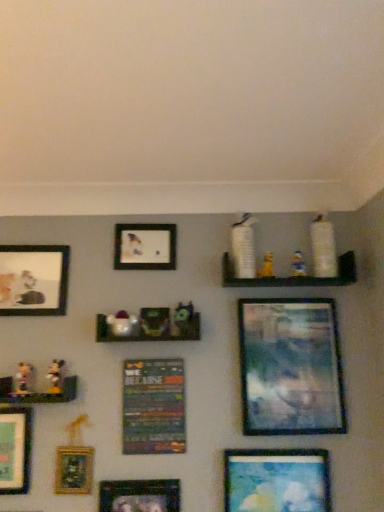
This screenshot has width=384, height=512. I want to click on matte glass picture frame at center right, the 1th picture frame from the right, so click(x=291, y=367).

Measure the distance between matte green picture frame at lower left, the first picture frame positioned from the left, and camera.

The depth of matte green picture frame at lower left, the first picture frame positioned from the left, is 4.33 feet.

This screenshot has height=512, width=384. Describe the element at coordinates (121, 323) in the screenshot. I see `matte plastic toy at center, the fifth toy viewed from the right` at that location.

What do you see at coordinates (55, 376) in the screenshot? The width and height of the screenshot is (384, 512). I see `shiny metallic mickey mouse at lower left, the 6th toy in the right-to-left sequence` at bounding box center [55, 376].

Consider the image. Measure the distance between matte black picture frame at upper center, which is counted as the fifth picture frame, starting from the left, and camera.

matte black picture frame at upper center, which is counted as the fifth picture frame, starting from the left, and camera are 1.50 meters apart from each other.

Describe the element at coordinates (145, 247) in the screenshot. This screenshot has height=512, width=384. I see `matte black picture frame at upper center, which is counted as the fifth picture frame, starting from the left` at that location.

This screenshot has height=512, width=384. Identify the location of matte glass picture frame at center right, the 1th picture frame from the right. (291, 367).

Is yellow fabric toy at upper center, arranged as the sixth toy when viewed from the left, facing towards green matte toy at center, the 4th toy viewed from the right?

No, yellow fabric toy at upper center, arranged as the sixth toy when viewed from the left, is not facing towards green matte toy at center, the 4th toy viewed from the right.

Is yellow fabric toy at upper center, which is the 2th toy from right to left, further to the viewer compared to green matte toy at center, the 4th toy viewed from the right?

Yes.

In the scene shown: From their relative heights in the image, would you say yellow fabric toy at upper center, which is the 2th toy from right to left, is taller or shorter than green matte toy at center, the 4th toy viewed from the right?

Considering their sizes, yellow fabric toy at upper center, which is the 2th toy from right to left, has less height than green matte toy at center, the 4th toy viewed from the right.

Which object is positioned more to the left, yellow fabric toy at upper center, which is the 2th toy from right to left, or green matte toy at center, the 4th toy viewed from the right?

From the viewer's perspective, green matte toy at center, the 4th toy viewed from the right, appears more on the left side.

How different are the orientations of white glossy vase at upper center, which is the 5th toy in left-to-right order, and metallic poster at center, arranged as the 3th picture frame when viewed from the right, in degrees?

The angular difference between white glossy vase at upper center, which is the 5th toy in left-to-right order, and metallic poster at center, arranged as the 3th picture frame when viewed from the right, is 5.06 degrees.

Looking at the image, does white glossy vase at upper center, which is the 5th toy in left-to-right order, seem bigger or smaller compared to metallic poster at center, positioned as the 6th picture frame in left-to-right order?

white glossy vase at upper center, which is the 5th toy in left-to-right order, is smaller than metallic poster at center, positioned as the 6th picture frame in left-to-right order.

From a real-world perspective, which object rests below the other?

From a 3D spatial view, metallic poster at center, arranged as the 3th picture frame when viewed from the right, is below.

Identify the location of the 1st picture frame counting from the left of the white glossy vase at upper center, the 3th toy positioned from the right. (153, 407).

Which is correct: gold-framed painting at lower left, the 6th picture frame from the right, is inside matte glass picture frame at center right, the 1th picture frame from the right, or outside of it?

gold-framed painting at lower left, the 6th picture frame from the right, is not inside matte glass picture frame at center right, the 1th picture frame from the right, it's outside.

Does point (63, 470) come farther from viewer compared to point (299, 388)?

No, it is in front of (299, 388).

From the image's perspective, is gold-framed painting at lower left, the 6th picture frame from the right, over matte glass picture frame at center right, the 1th picture frame from the right?

Actually, gold-framed painting at lower left, the 6th picture frame from the right, appears below matte glass picture frame at center right, the 1th picture frame from the right, in the image.

Can you confirm if gold-framed painting at lower left, which appears as the third picture frame when viewed from the left, is smaller than matte glass picture frame at center right, placed as the 8th picture frame when sorted from left to right?

Yes.

Can you tell me how much matte plastic toy at center, the 3th toy positioned from the left, and matte black picture frame at upper center, the 4th picture frame when ordered from right to left, differ in facing direction?

3.24 degrees separate the facing orientations of matte plastic toy at center, the 3th toy positioned from the left, and matte black picture frame at upper center, the 4th picture frame when ordered from right to left.

From the image's perspective, between matte plastic toy at center, the fifth toy viewed from the right, and matte black picture frame at upper center, which is counted as the fifth picture frame, starting from the left, who is located below?

From the image's view, matte plastic toy at center, the fifth toy viewed from the right, is below.

Between matte plastic toy at center, the fifth toy viewed from the right, and matte black picture frame at upper center, which is counted as the fifth picture frame, starting from the left, which one has smaller size?

Smaller between the two is matte plastic toy at center, the fifth toy viewed from the right.

In the image, is matte plastic toy at center, the fifth toy viewed from the right, positioned in front of or behind matte black picture frame at upper center, the 4th picture frame when ordered from right to left?

In the image, matte plastic toy at center, the fifth toy viewed from the right, appears in front of matte black picture frame at upper center, the 4th picture frame when ordered from right to left.

From the image's perspective, which one is positioned higher, matte blue painting at lower right, acting as the 7th picture frame starting from the left, or matte glass picture frame at center right, placed as the 8th picture frame when sorted from left to right?

matte glass picture frame at center right, placed as the 8th picture frame when sorted from left to right.

The width and height of the screenshot is (384, 512). Find the location of `the 1st picture frame counting from the left of the matte glass picture frame at center right, the 1th picture frame from the right`. the 1st picture frame counting from the left of the matte glass picture frame at center right, the 1th picture frame from the right is located at coordinates (277, 480).

How much distance is there between matte blue painting at lower right, acting as the 7th picture frame starting from the left, and matte glass picture frame at center right, placed as the 8th picture frame when sorted from left to right?

8.68 inches.

Considering the sizes of matte blue painting at lower right, arranged as the 2th picture frame when viewed from the right, and matte glass picture frame at center right, the 1th picture frame from the right, in the image, is matte blue painting at lower right, arranged as the 2th picture frame when viewed from the right, wider or thinner than matte glass picture frame at center right, the 1th picture frame from the right,?

In the image, matte blue painting at lower right, arranged as the 2th picture frame when viewed from the right, appears to be more narrow than matte glass picture frame at center right, the 1th picture frame from the right.

In terms of size, does gold-framed painting at lower left, which appears as the third picture frame when viewed from the left, appear bigger or smaller than metallic silver picture frame at lower center, which is the fourth picture frame from left to right?

Considering their sizes, gold-framed painting at lower left, which appears as the third picture frame when viewed from the left, takes up less space than metallic silver picture frame at lower center, which is the fourth picture frame from left to right.

How many degrees apart are the facing directions of gold-framed painting at lower left, which appears as the third picture frame when viewed from the left, and metallic silver picture frame at lower center, which ranks as the 5th picture frame in right-to-left order?

0.546 degrees.

Which is less distant, (55, 477) or (159, 496)?

Point (55, 477).

Could you tell me if gold-framed painting at lower left, the 6th picture frame from the right, is turned towards metallic silver picture frame at lower center, which is the fourth picture frame from left to right?

No, gold-framed painting at lower left, the 6th picture frame from the right, is not facing towards metallic silver picture frame at lower center, which is the fourth picture frame from left to right.

Is shiny metallic mickey mouse at lower left, the 6th toy in the right-to-left sequence, oriented away from white matte toy at upper right, the 1th toy in the right-to-left sequence?

No, white matte toy at upper right, the 1th toy in the right-to-left sequence, is not at the back of shiny metallic mickey mouse at lower left, the 6th toy in the right-to-left sequence.

Does point (52, 389) come behind point (296, 276)?

No, it is not.

How different are the orientations of shiny metallic mickey mouse at lower left, which is the 2th toy in left-to-right order, and white matte toy at upper right, the 1th toy in the right-to-left sequence, in degrees?

11.9 degrees.

How much distance is there between shiny metallic mickey mouse at lower left, the 6th toy in the right-to-left sequence, and white matte toy at upper right, arranged as the seventh toy when viewed from the left?

shiny metallic mickey mouse at lower left, the 6th toy in the right-to-left sequence, and white matte toy at upper right, arranged as the seventh toy when viewed from the left, are 34.34 inches apart.

There is a yellow fabric toy at upper center, arranged as the sixth toy when viewed from the left. In order to click on the 2nd toy below it (from a real-world perspective) in this screenshot , I will do `click(183, 318)`.

Where is `the 7th toy above the metallic poster at center, positioned as the 6th picture frame in left-to-right order (from a real-world perspective)`? This screenshot has width=384, height=512. the 7th toy above the metallic poster at center, positioned as the 6th picture frame in left-to-right order (from a real-world perspective) is located at coordinates click(244, 247).

Considering their positions, is matte blue painting at lower right, arranged as the 2th picture frame when viewed from the right, positioned closer to white matte toy at upper right, arranged as the seventh toy when viewed from the left, than white matte shelf at upper center, which is the 3th shelf from bottom to top?

Among the two, white matte shelf at upper center, which is the 3th shelf from bottom to top, is located nearer to white matte toy at upper right, arranged as the seventh toy when viewed from the left.

Estimate the real-world distances between objects in this image. Which object is closer to matte plastic shelf at center, acting as the 2th shelf starting from the left, matte blue painting at lower right, acting as the 7th picture frame starting from the left, or matte black picture frame at upper center, the 4th picture frame when ordered from right to left?

The object closer to matte plastic shelf at center, acting as the 2th shelf starting from the left, is matte black picture frame at upper center, the 4th picture frame when ordered from right to left.

From the image, which object appears to be farther from matte glass picture frame at center right, the 1th picture frame from the right, white matte toy at upper right, arranged as the seventh toy when viewed from the left, or shiny metallic mickey mouse at lower left, which is the 2th toy in left-to-right order?

shiny metallic mickey mouse at lower left, which is the 2th toy in left-to-right order.

Considering their positions, is matte black picture frame at upper center, the 4th picture frame when ordered from right to left, positioned closer to metallic silver picture frame at lower center, which is the fourth picture frame from left to right, than metallic gold mickey mouse figurine at left, arranged as the 7th toy when viewed from the right?

Based on the image, metallic gold mickey mouse figurine at left, arranged as the 7th toy when viewed from the right, appears to be nearer to metallic silver picture frame at lower center, which is the fourth picture frame from left to right.

Looking at the image, which one is located closer to matte glass picture frame at center right, the 1th picture frame from the right, matte plastic toy at center, the 3th toy positioned from the left, or yellow fabric toy at upper center, arranged as the sixth toy when viewed from the left?

yellow fabric toy at upper center, arranged as the sixth toy when viewed from the left, lies closer to matte glass picture frame at center right, the 1th picture frame from the right, than the other object.

Looking at the image, which one is located further to white matte toy at upper right, the 1th toy in the right-to-left sequence, metallic poster at center, arranged as the 3th picture frame when viewed from the right, or metallic gold mickey mouse figurine at left, which is the first toy in left-to-right order?

metallic gold mickey mouse figurine at left, which is the first toy in left-to-right order, is positioned further to the anchor white matte toy at upper right, the 1th toy in the right-to-left sequence.

Estimate the real-world distances between objects in this image. Which object is further from wooden mickey mouse figurines at lower left, which is the first shelf in left-to-right order, matte blue painting at lower right, arranged as the 2th picture frame when viewed from the right, or matte plastic shelf at center, arranged as the 2th shelf when viewed from the top?

Based on the image, matte blue painting at lower right, arranged as the 2th picture frame when viewed from the right, appears to be further to wooden mickey mouse figurines at lower left, which is the first shelf in left-to-right order.

When comparing their distances from white matte shelf at upper center, the third shelf from the left, does metallic silver picture frame at lower center, which is the fourth picture frame from left to right, or metallic poster at center, positioned as the 6th picture frame in left-to-right order, seem closer?

metallic poster at center, positioned as the 6th picture frame in left-to-right order, is positioned closer to the anchor white matte shelf at upper center, the third shelf from the left.

This screenshot has width=384, height=512. What are the coordinates of `shelf between metallic poster at center, arranged as the 3th picture frame when viewed from the right, and matte glass picture frame at center right, placed as the 8th picture frame when sorted from left to right` in the screenshot? It's located at (293, 276).

Find the location of a particular element. This screenshot has height=512, width=384. shelf between metallic gold mickey mouse figurine at left, which is the first toy in left-to-right order, and matte green picture frame at lower left, the first picture frame positioned from the left, in the vertical direction is located at coordinates (39, 392).

What are the coordinates of `toy between wooden mickey mouse figurines at lower left, which ranks as the 1th shelf in bottom-to-top order, and matte plastic toy at center, the fifth toy viewed from the right, from left to right` in the screenshot? It's located at (55, 376).

Locate an element on the screen. Image resolution: width=384 pixels, height=512 pixels. shelf situated between gold-framed painting at lower left, the 6th picture frame from the right, and white matte shelf at upper center, placed as the 1th shelf when sorted from right to left, from left to right is located at coordinates (148, 334).